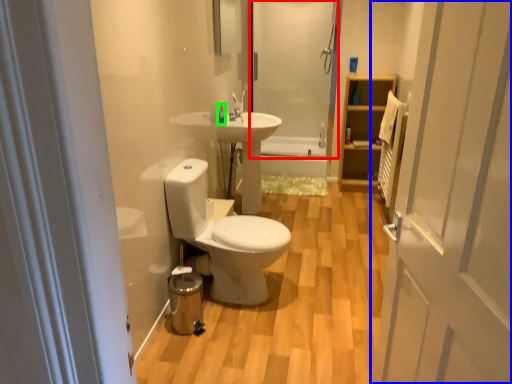
Question: Which is farther away from shower door (highlighted by a red box)? door (highlighted by a blue box) or toiletry (highlighted by a green box)?

Choices:
 (A) door
 (B) toiletry

Answer: (A)